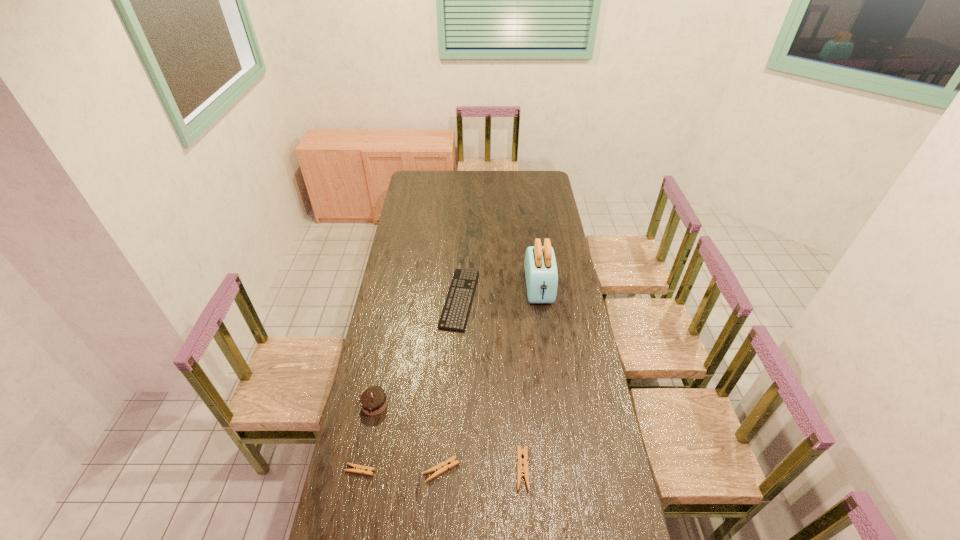
The width and height of the screenshot is (960, 540). I want to click on free point between the leftmost clothespin and the computer keyboard, so click(410, 384).

Where is `free space between the shortest clothespin and the second clothespin from left to right`? Image resolution: width=960 pixels, height=540 pixels. free space between the shortest clothespin and the second clothespin from left to right is located at coordinates (400, 470).

The height and width of the screenshot is (540, 960). I want to click on the second closest object to the tallest object, so pyautogui.click(x=522, y=471).

Point out which object is positioned as the third nearest to the chocolate cake. Please provide its 2D coordinates. Your answer should be formatted as a tuple, i.e. [(x, y)], where the tuple contains the x and y coordinates of a point satisfying the conditions above.

[(454, 315)]

The width and height of the screenshot is (960, 540). What are the coordinates of `clothespin that is the second closest to the computer keyboard` in the screenshot? It's located at (438, 469).

Point out which clothespin is positioned as the nearest to the third tallest object. Please provide its 2D coordinates. Your answer should be formatted as a tuple, i.e. [(x, y)], where the tuple contains the x and y coordinates of a point satisfying the conditions above.

[(438, 469)]